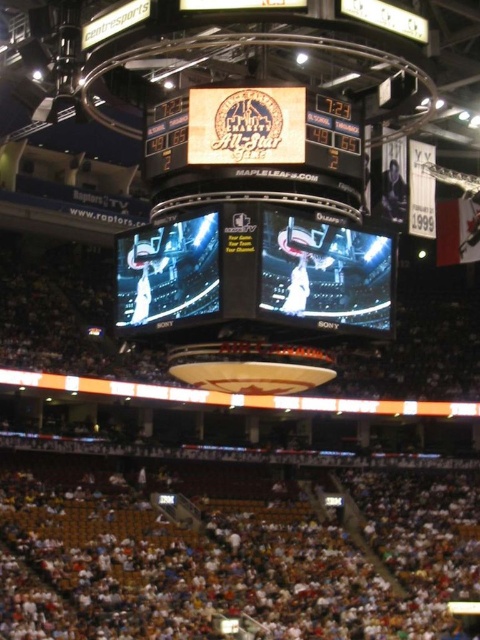
Question: Can you confirm if black glossy scoreboard at center is positioned above wooden sign at center?

Choices:
 (A) yes
 (B) no

Answer: (B)

Question: Which point appears farthest from the camera in this image?

Choices:
 (A) (388, 532)
 (B) (120, 307)

Answer: (A)

Question: Which object is positioned closest to the black glossy scoreboard at center?

Choices:
 (A) white fabric crowd at lower center
 (B) wooden sign at center

Answer: (B)

Question: Which point is farther to the camera?

Choices:
 (A) (328, 172)
 (B) (386, 269)

Answer: (B)

Question: Does white fabric crowd at lower center lie behind wooden sign at center?

Choices:
 (A) yes
 (B) no

Answer: (A)

Question: Observing the image, what is the correct spatial positioning of black glossy scoreboard at center in reference to wooden sign at center?

Choices:
 (A) below
 (B) above

Answer: (A)